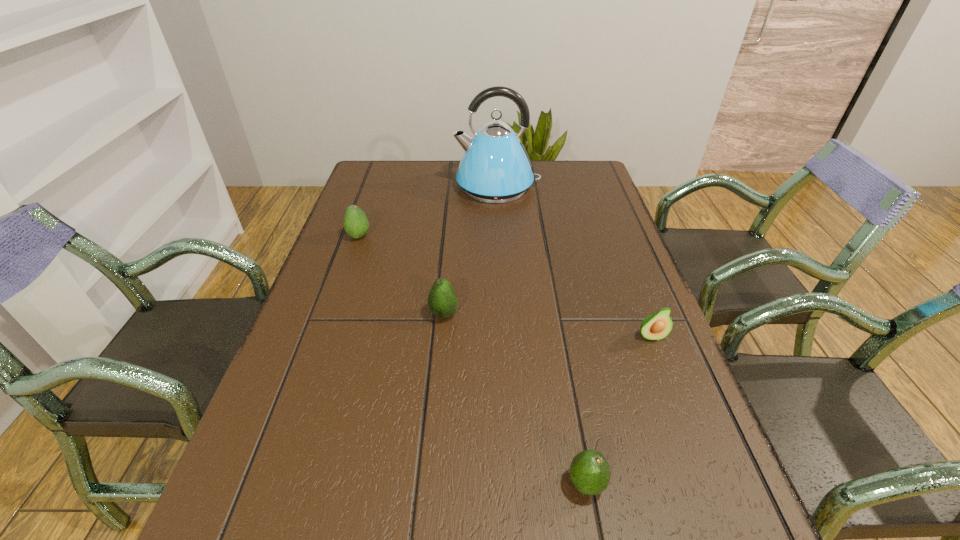
Where is `vacant space at the left edge`? vacant space at the left edge is located at coordinates (313, 369).

Where is `vacant space at the right edge of the desktop`? This screenshot has width=960, height=540. vacant space at the right edge of the desktop is located at coordinates (663, 427).

At what (x,y) coordinates should I click in order to perform the action: click on free spot at the far right corner of the desktop. Please return your answer as a coordinate pair (x, y). This screenshot has height=540, width=960. Looking at the image, I should click on (565, 181).

Where is `vacant space that is in between the fourth farthest object and the second farthest avocado`? vacant space that is in between the fourth farthest object and the second farthest avocado is located at coordinates (547, 325).

At what (x,y) coordinates should I click in order to perform the action: click on free spot between the third avocado from left to right and the third nearest avocado. Please return your answer as a coordinate pair (x, y). This screenshot has height=540, width=960. Looking at the image, I should click on [516, 399].

Find the location of a particular element. Image resolution: width=960 pixels, height=540 pixels. empty space that is in between the kettle and the second avocado from left to right is located at coordinates (470, 250).

Find the location of a particular element. This screenshot has height=540, width=960. free spot between the third farthest object and the farthest avocado is located at coordinates (401, 275).

In order to click on empty space between the farthest object and the nearest avocado in this screenshot , I will do `click(541, 335)`.

Identify the location of free area in between the rightmost object and the farthest avocado. (505, 286).

Find the location of a particular element. vacant space that's between the leftmost object and the kettle is located at coordinates (428, 211).